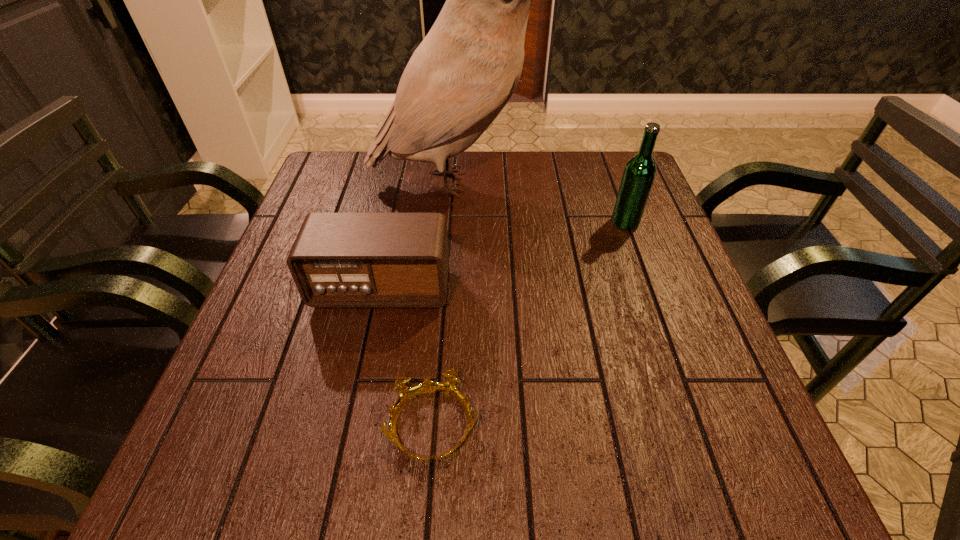
Image resolution: width=960 pixels, height=540 pixels. Find the location of `vacant space located 0.260m on the front-facing side of the third farthest object`. vacant space located 0.260m on the front-facing side of the third farthest object is located at coordinates (351, 431).

Locate an element on the screen. The image size is (960, 540). free spot located 0.360m on the right of the shortest object is located at coordinates (691, 426).

You are a GUI agent. You are given a task and a screenshot of the screen. Output one action in this format:
    pyautogui.click(x=<x>, y=<y>)
    Task: Click on the object positioned at the far edge
    The image size is (960, 540).
    Given the screenshot: What is the action you would take?
    pyautogui.click(x=463, y=73)

I want to click on object that is at the near edge, so click(x=406, y=393).

The height and width of the screenshot is (540, 960). Find the location of `parakeet that is at the left edge`. parakeet that is at the left edge is located at coordinates (463, 73).

The height and width of the screenshot is (540, 960). I want to click on radio receiver present at the left edge, so click(338, 260).

The image size is (960, 540). Find the location of `object that is at the right edge`. object that is at the right edge is located at coordinates (639, 173).

I want to click on object at the far left corner, so click(463, 73).

This screenshot has width=960, height=540. In order to click on free location at the far edge in this screenshot , I will do `click(484, 186)`.

Find the location of a particular element. The image size is (960, 540). free space at the left edge is located at coordinates (329, 310).